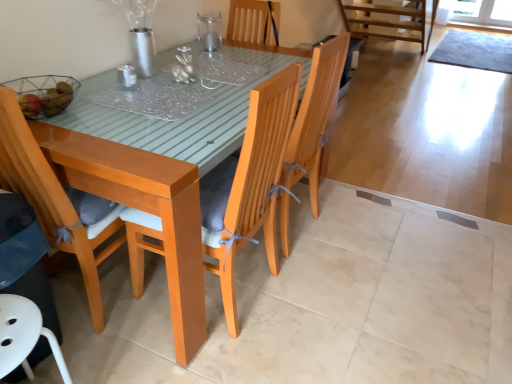
Question: From their relative heights in the image, would you say white plastic chair at lower left, placed as the first chair when sorted from left to right, is taller or shorter than clear glass vase at upper center, which appears as the first tableware when viewed from the right?

Choices:
 (A) tall
 (B) short

Answer: (A)

Question: Relative to clear glass vase at upper center, which appears as the first tableware when viewed from the right, is white plastic chair at lower left, placed as the first chair when sorted from left to right, in front or behind?

Choices:
 (A) front
 (B) behind

Answer: (A)

Question: Which is nearer to the metallic silver candlestick at center, the second tableware when ordered from top to bottom?

Choices:
 (A) matte wood chair at left, placed as the 2th chair when sorted from left to right
 (B) clear glass vase at upper center, acting as the second tableware starting from the front
 (C) wooden chair at center, marked as the first chair in a right-to-left arrangement
 (D) wooden swivel chair at lower left
 (E) white plastic chair at lower left, which ranks as the third chair in right-to-left order

Answer: (A)

Question: Based on their relative distances, which object is farther from the white plastic chair at lower left, which ranks as the third chair in right-to-left order?

Choices:
 (A) metallic silver candlestick at center, positioned as the second tableware in right-to-left order
 (B) wooden chair at center, the third chair positioned from the left
 (C) matte wood chair at left, positioned as the 2th chair in right-to-left order
 (D) wooden swivel chair at lower left
 (E) clear glass vase at upper center, the 1th tableware viewed from the top

Answer: (E)